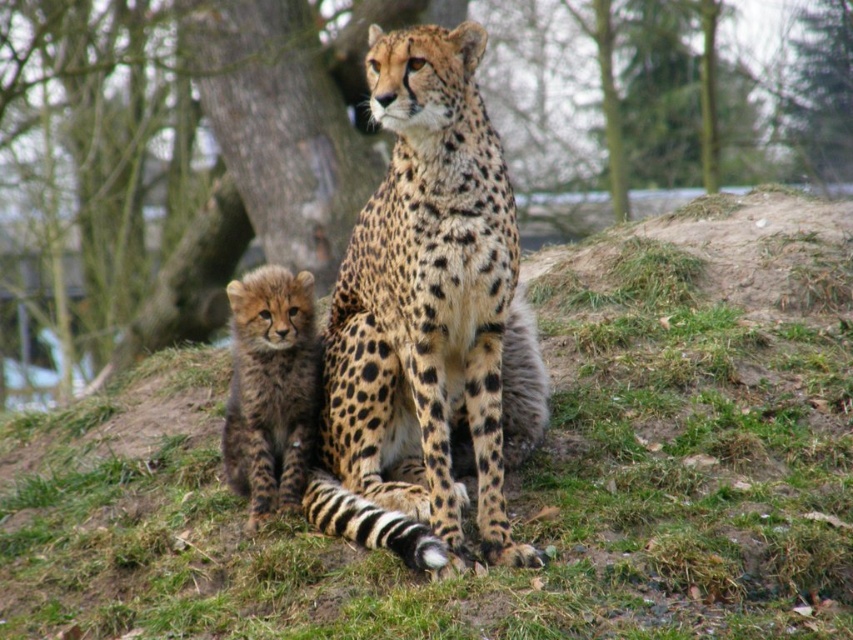
Looking at this image, you are a photographer trying to capture both the brown bark tree at center and the spotted fur cheetah at center in the same frame. Given their sizes, which one will appear larger in your photo?

The spotted fur cheetah at center will appear larger in the photo because the brown bark tree at center is much taller, meaning it is farther away from the camera compared to the cheetah.

Looking at this image, you are a photographer taking a picture of the fuzzy green grass at center and the spotted fur cub at lower left. Which object is closer to the camera?

The fuzzy green grass at center is closer to the viewer than the spotted fur cub at lower left.